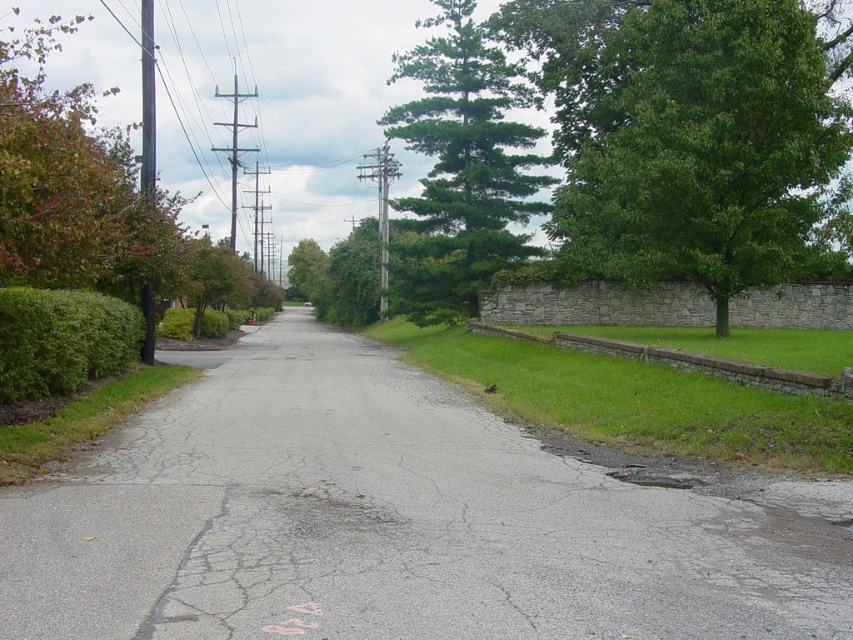
Can you confirm if green leafy tree at left is wider than green leafy hedge at left?

Correct, the width of green leafy tree at left exceeds that of green leafy hedge at left.

Measure the distance from green leafy tree at left to green leafy hedge at left.

green leafy tree at left and green leafy hedge at left are 22.17 meters apart from each other.

Is point (22, 266) closer to viewer compared to point (3, 289)?

Yes, it is.

The height and width of the screenshot is (640, 853). I want to click on green leafy tree at left, so click(x=91, y=198).

Is gray asphalt driveway at center shorter than green textured pine tree at upper center?

Yes, gray asphalt driveway at center is shorter than green textured pine tree at upper center.

Between gray asphalt driveway at center and green textured pine tree at upper center, which one has less height?

gray asphalt driveway at center is shorter.

Between point (239, 616) and point (445, 307), which one is positioned in front?

Point (239, 616) is more forward.

This screenshot has height=640, width=853. In order to click on gray asphalt driveway at center in this screenshot , I will do `click(392, 520)`.

Looking at this image, between green leafy tree at right and green textured pine tree at upper center, which one has more height?

With more height is green textured pine tree at upper center.

This screenshot has height=640, width=853. In order to click on green leafy tree at right in this screenshot , I will do `click(700, 147)`.